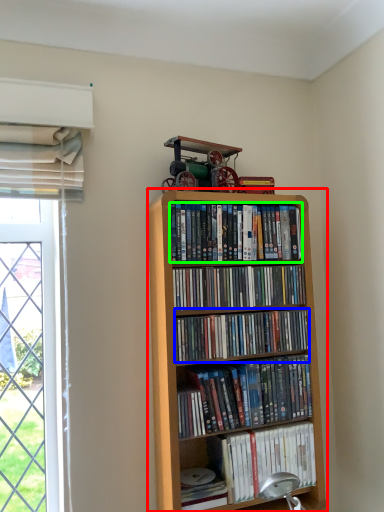
Question: Considering the real-world distances, which object is farthest from bookcase (highlighted by a red box)? book (highlighted by a blue box) or book (highlighted by a green box)?

Choices:
 (A) book
 (B) book

Answer: (B)